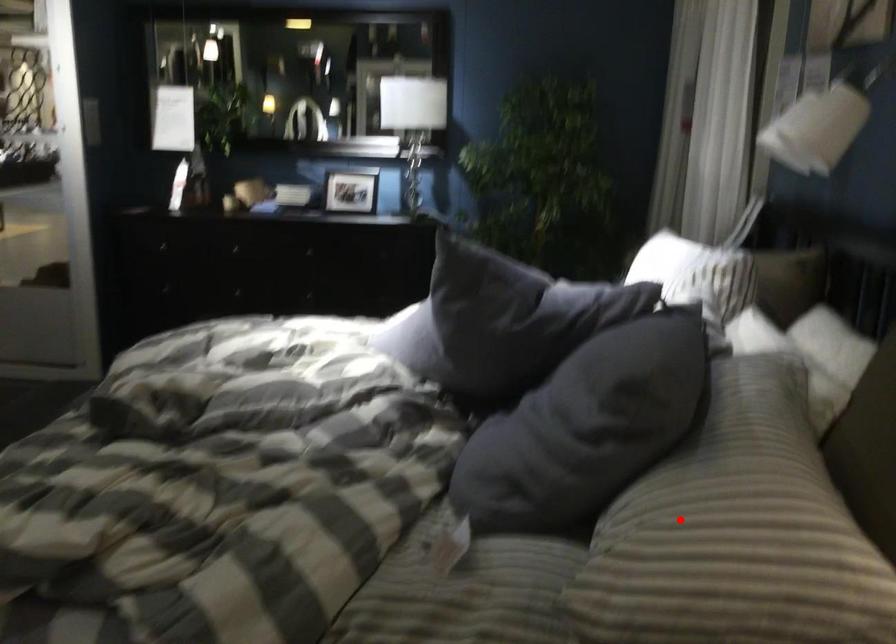
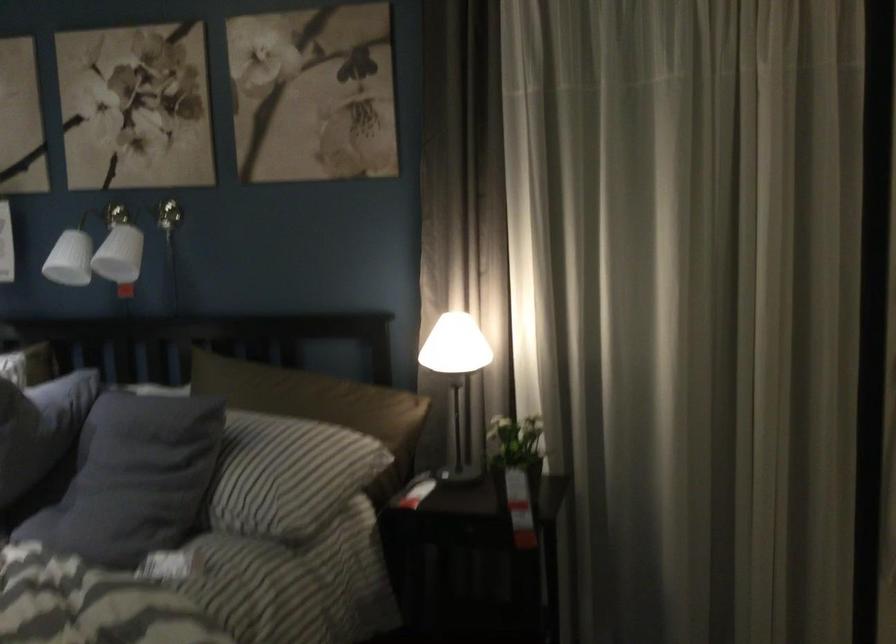
Question: I am providing you with two images of the same scene from different viewpoints. In image1, a red point is highlighted. Considering the same 3D point in image2, which of the following is correct?

Choices:
 (A) It is closer
 (B) It is farther

Answer: (B)